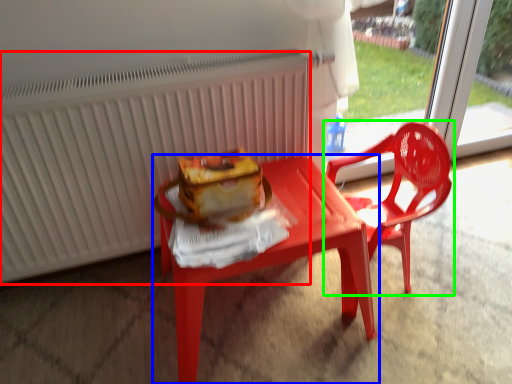
Question: Which object is the closest to the radiator (highlighted by a red box)? Choose among these: table (highlighted by a blue box) or chair (highlighted by a green box).

Choices:
 (A) table
 (B) chair

Answer: (A)